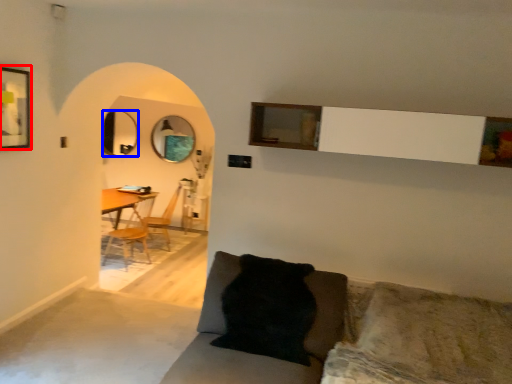
Question: Which of the following is the closest to the observer, picture frame (highlighted by a red box) or mirror (highlighted by a blue box)?

Choices:
 (A) picture frame
 (B) mirror

Answer: (A)